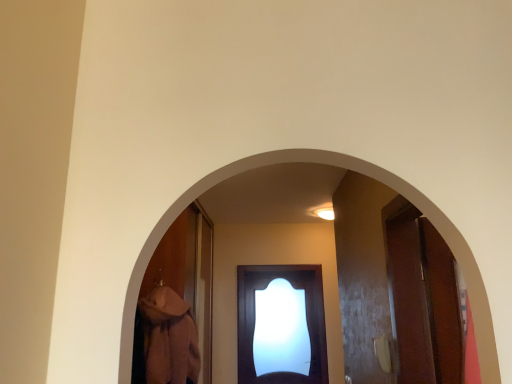
Question: From the image's perspective, is smooth wooden archway at center located above or below matte dark wood door at center?

Choices:
 (A) below
 (B) above

Answer: (B)

Question: Is point (267, 162) positioned closer to the camera than point (310, 370)?

Choices:
 (A) closer
 (B) farther

Answer: (A)

Question: Which object is the closest to the smooth wooden archway at center?

Choices:
 (A) white glossy light at upper center
 (B) matte dark wood door at center

Answer: (A)

Question: Which is nearer to the white glossy light at upper center?

Choices:
 (A) smooth wooden archway at center
 (B) matte dark wood door at center

Answer: (B)